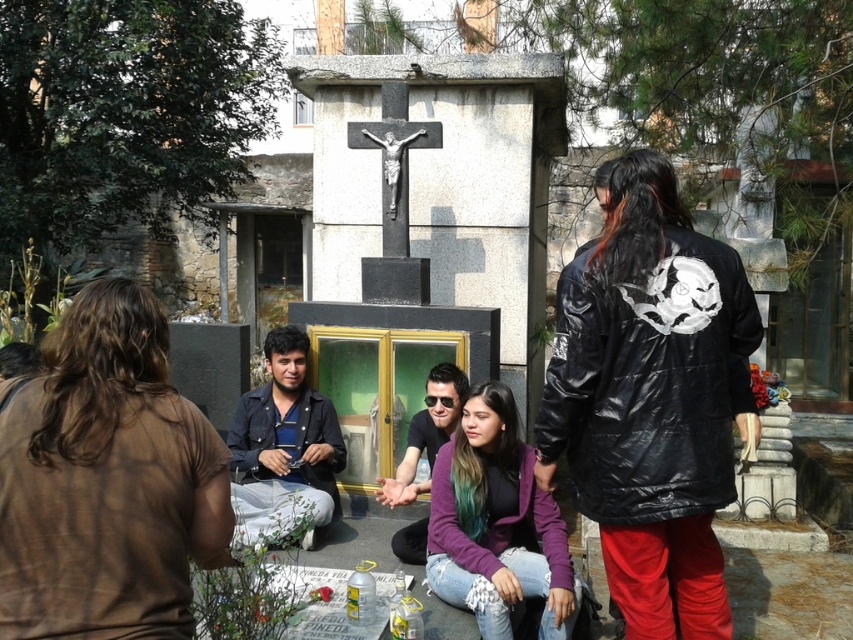
Does shiny black jacket at center have a smaller size compared to denim jacket at center?

Correct, shiny black jacket at center occupies less space than denim jacket at center.

Which of these two, shiny black jacket at center or denim jacket at center, stands shorter?

denim jacket at center is shorter.

Which is in front, point (734, 497) or point (254, 493)?

Point (734, 497) is more forward.

Where is `shiny black jacket at center`? This screenshot has width=853, height=640. shiny black jacket at center is located at coordinates (648, 400).

Measure the distance between shiny black jacket at center and black matte sunglasses at center.

shiny black jacket at center is 3.89 feet away from black matte sunglasses at center.

Who is more forward, (x=664, y=602) or (x=416, y=420)?

Positioned in front is point (x=664, y=602).

The height and width of the screenshot is (640, 853). What do you see at coordinates (648, 400) in the screenshot? I see `shiny black jacket at center` at bounding box center [648, 400].

The image size is (853, 640). I want to click on shiny black jacket at center, so click(x=648, y=400).

Who is more distant from viewer, [311,474] or [412,440]?

The point [311,474] is more distant.

Looking at this image, does denim jacket at center have a larger size compared to black matte sunglasses at center?

Yes.

The image size is (853, 640). What do you see at coordinates (283, 436) in the screenshot? I see `denim jacket at center` at bounding box center [283, 436].

Where is `denim jacket at center`? denim jacket at center is located at coordinates (283, 436).